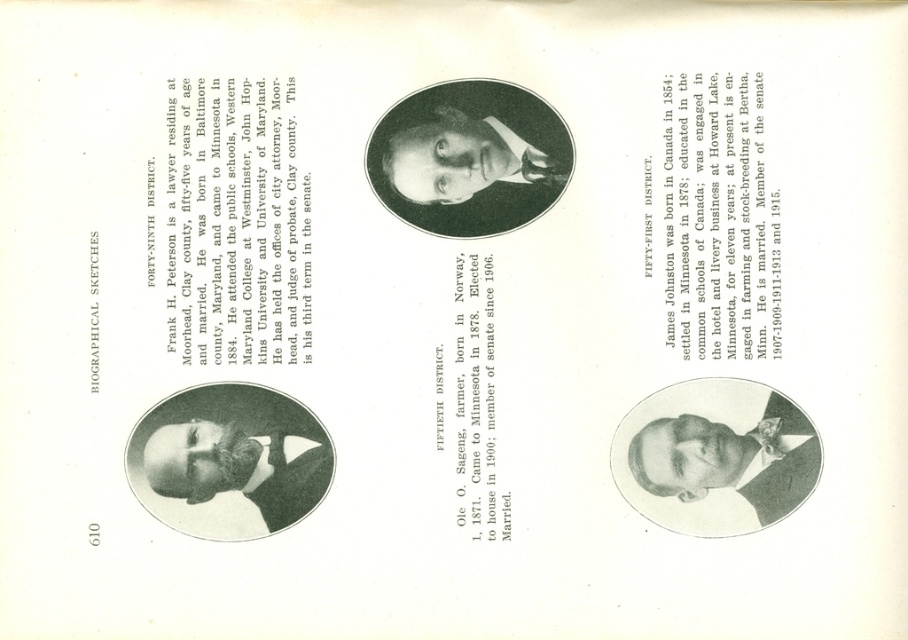
Does point (790, 502) come farther from viewer compared to point (469, 138)?

No, (790, 502) is in front of (469, 138).

Based on the photo, can you confirm if smooth black suit at lower right is positioned to the left of black matte portrait at center?

In fact, smooth black suit at lower right is to the right of black matte portrait at center.

Identify the location of smooth black suit at lower right. The image size is (908, 640). [x=727, y=467].

Locate an element on the screen. Image resolution: width=908 pixels, height=640 pixels. smooth black suit at lower right is located at coordinates (727, 467).

Does point (677, 483) come farther from viewer compared to point (480, 467)?

No, (677, 483) is closer to viewer.

Which is above, smooth black suit at lower right or black paper text at center?

black paper text at center

Is point (682, 477) farther from camera compared to point (475, 340)?

No, it is in front of (475, 340).

Locate an element on the screen. Image resolution: width=908 pixels, height=640 pixels. smooth black suit at lower right is located at coordinates (727, 467).

Which of these two, black paper at upper center or black matte portrait at center, stands taller?

With more height is black paper at upper center.

Does black paper at upper center come behind black matte portrait at center?

No, black paper at upper center is closer to the viewer.

Which is in front, point (308, 355) or point (401, 168)?

Point (308, 355) is in front.

Where is `black paper at upper center`? This screenshot has height=640, width=908. black paper at upper center is located at coordinates (235, 225).